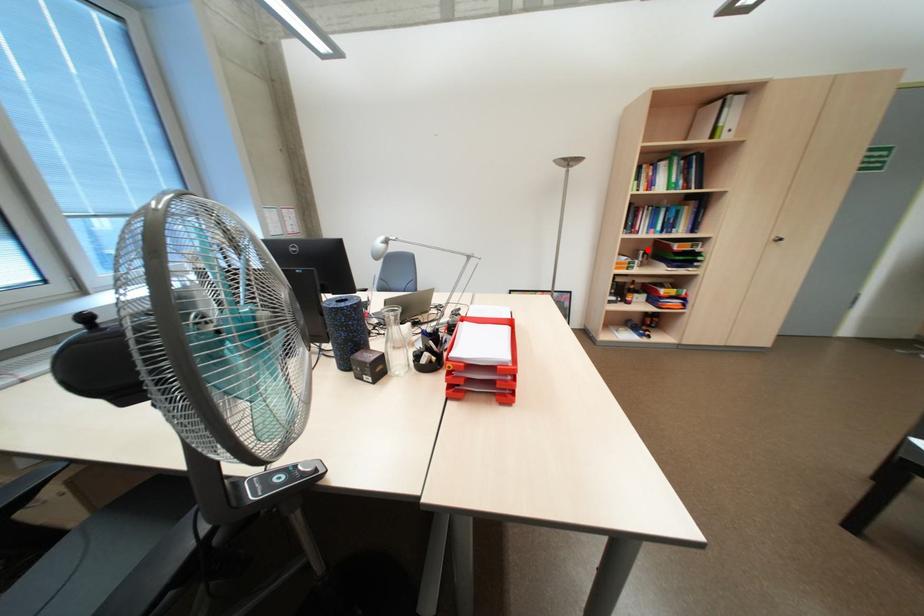
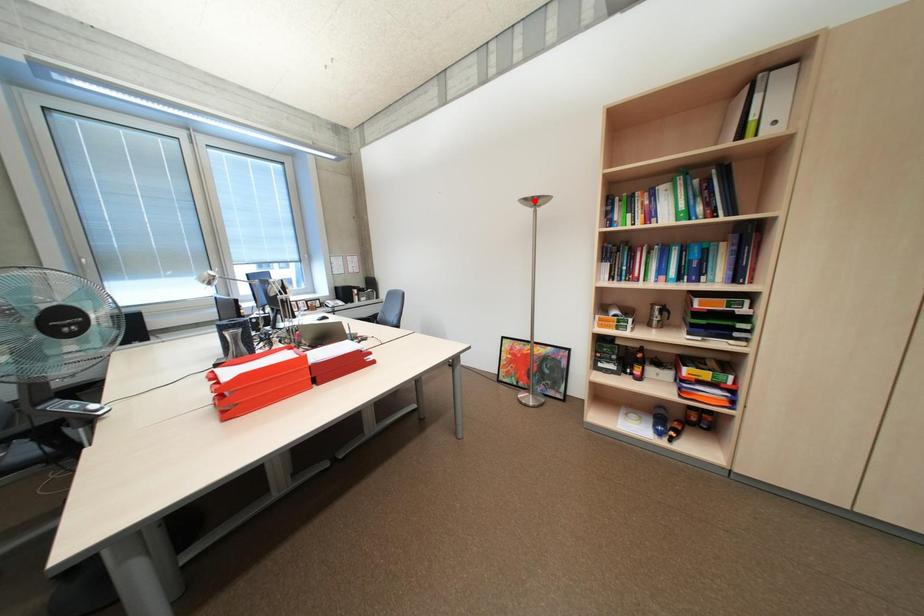
I am providing you with two images of the same scene from different viewpoints. A red point is marked on the first image and another point is marked on the second image. Does the point marked in image1 correspond to the same location as the one in image2?

No